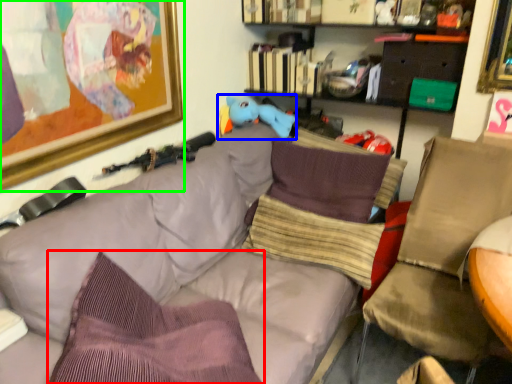
Question: Estimate the real-world distances between objects in this image. Which object is farther from pillow (highlighted by a red box), toy (highlighted by a blue box) or picture frame (highlighted by a green box)?

Choices:
 (A) toy
 (B) picture frame

Answer: (A)